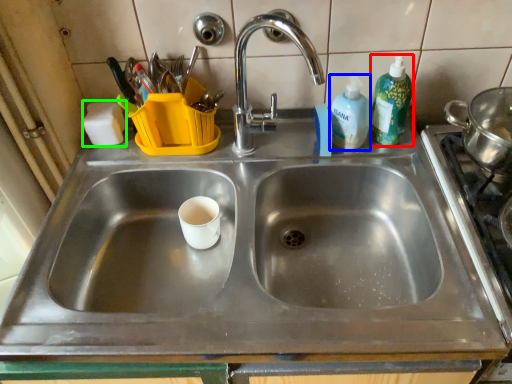
Question: Based on their relative distances, which object is farther from cleaning product (highlighted by a red box)? Choose from cleaning product (highlighted by a blue box) and soap (highlighted by a green box).

Choices:
 (A) cleaning product
 (B) soap

Answer: (B)